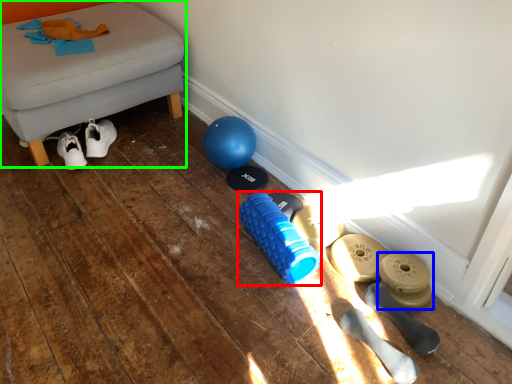
Question: Estimate the real-world distances between objects in this image. Which object is farther from dumbbell (highlighted by a red box), footwear (highlighted by a blue box) or furniture (highlighted by a green box)?

Choices:
 (A) footwear
 (B) furniture

Answer: (B)